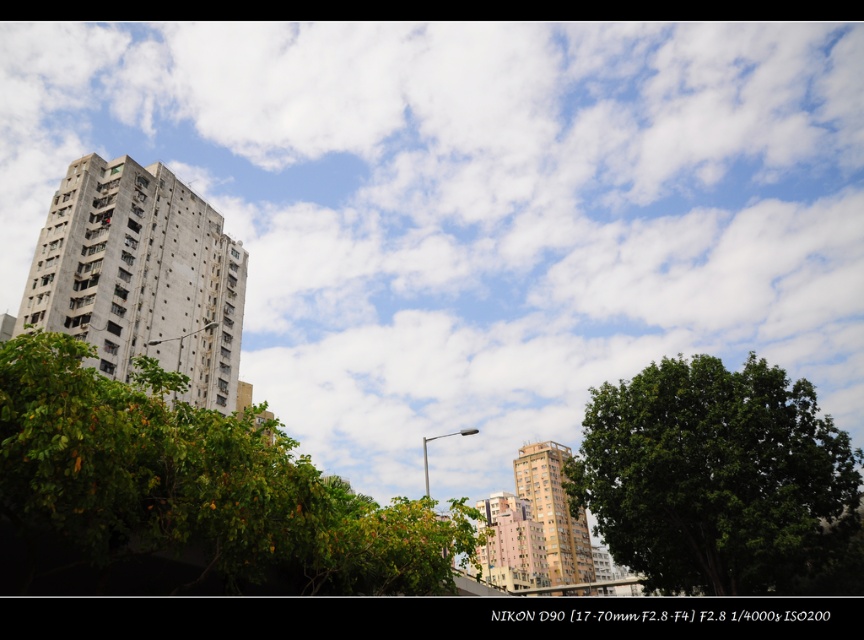
You are standing in the urban area and see the green leafy tree at lower left and the green leafy tree at center. Which tree is closer to you?

The green leafy tree at lower left is closer to you because it is in front of the green leafy tree at center.

You are standing in the middle of the street looking at the gray concrete building at left and the green leafy tree at lower left. Which object appears closer to you based on their sizes?

The green leafy tree at lower left appears closer because it has a smaller size compared to the gray concrete building at left, which is larger and likely farther away.

You are a city planner assessing the urban layout. You need to determine if the green leafy tree at lower left can block sunlight to the pink matte building at center during the afternoon. Based on their heights, what would you conclude?

The green leafy tree at lower left is shorter than the pink matte building at center, so it is unlikely to block sunlight to the pink matte building at center during the afternoon.